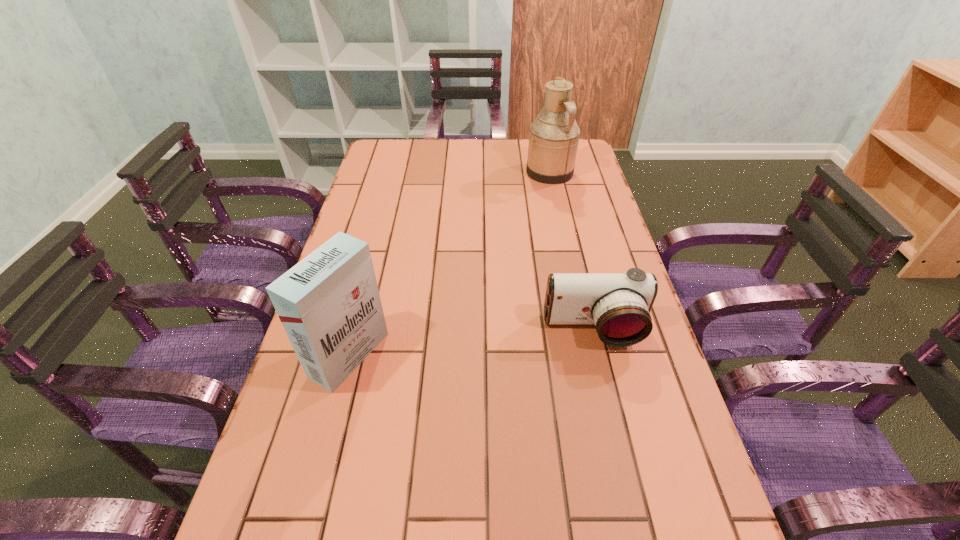
You are a GUI agent. You are given a task and a screenshot of the screen. Output one action in this format:
    pyautogui.click(x=<x>, y=<y>)
    Task: Click on the vacant point located between the camcorder and the pitcher
    
    Given the screenshot: What is the action you would take?
    pyautogui.click(x=572, y=251)

Locate an element on the screen. The height and width of the screenshot is (540, 960). the closest object to the leftmost object is located at coordinates (619, 304).

Image resolution: width=960 pixels, height=540 pixels. Identify the location of object that is the closest to the camcorder. (329, 304).

Locate an element on the screen. The height and width of the screenshot is (540, 960). free space that satisfies the following two spatial constraints: 1. on the back side of the second tallest object; 2. on the left side of the farthest object is located at coordinates (396, 172).